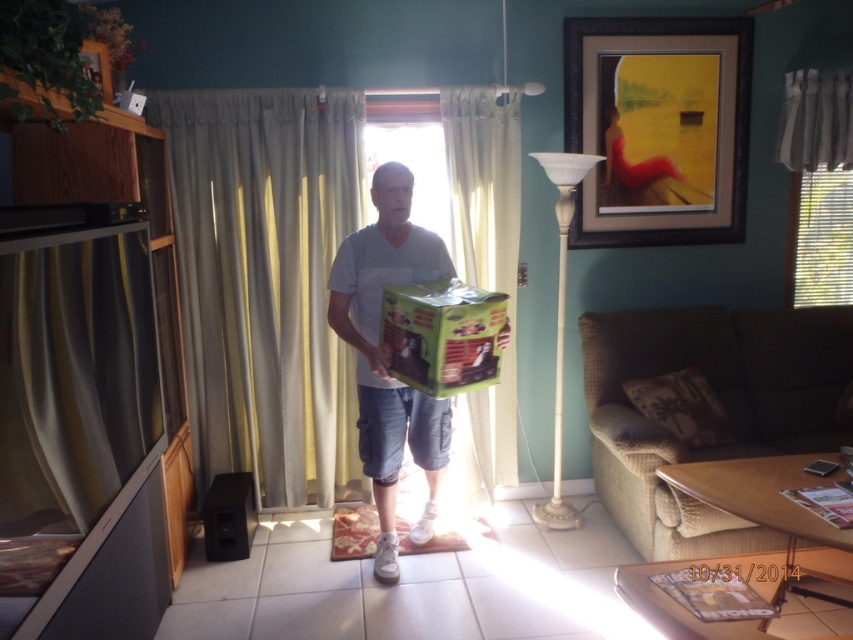
You are a guest in this living room and want to admire the view outside the window. However, you notice the green fabric curtain at center and the wooden framed artwork at upper right. Which object is closer to the window to block the view?

The green fabric curtain at center is to the left of the wooden framed artwork at upper right, so it is closer to the window and blocking the view.

Please describe the location of the point with coordinates (659, 128) in the living room scene.

The point with coordinates (659, 128) is located on the wooden framed artwork at upper right.

You are a delivery person who just arrived at this address. You need to place the green matte cardboard box at lower left somewhere near the window. However, you must ensure that the box doesn not block the view of the wooden framed artwork at upper right. Can you do this?

The wooden framed artwork at upper right is above the green matte cardboard box at lower left, so placing the box near the window at lower left would not block the view of the artwork since it is positioned below it.